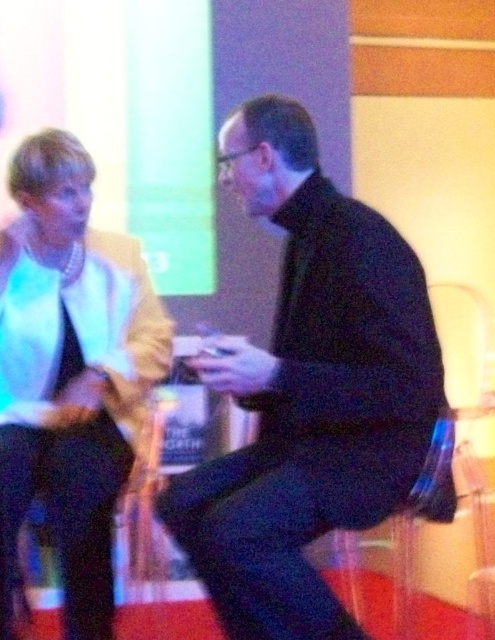
Which is more to the right, black matte jacket at center or matte white jacket at left?

From the viewer's perspective, black matte jacket at center appears more on the right side.

Is point (347, 244) in front of point (66, 422)?

Yes, it is in front of point (66, 422).

Is point (298, 220) behind point (14, 380)?

No.

Identify the location of black matte jacket at center. The height and width of the screenshot is (640, 495). (308, 390).